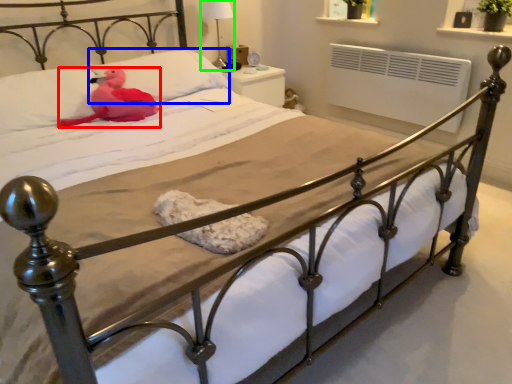
Question: Which object is positioned closest to animal (highlighted by a red box)? Select from pillow (highlighted by a blue box) and table lamp (highlighted by a green box).

Choices:
 (A) pillow
 (B) table lamp

Answer: (A)